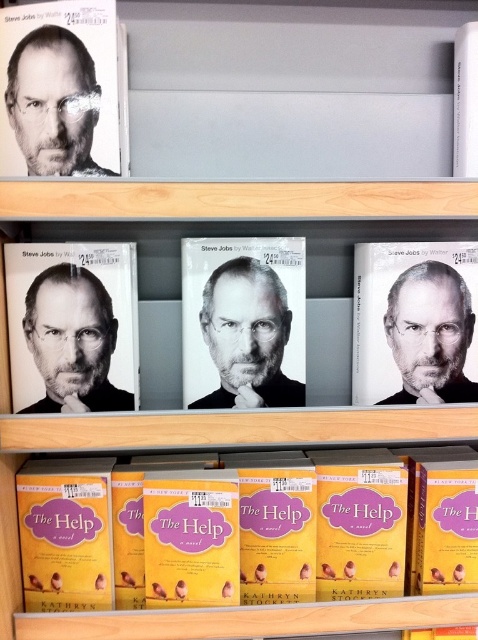
You are organizing books in a bookstore and need to place a new yellow paperback at the same location as the existing yellow paperbacks at lower center. According to the store layout, the coordinates for the lower shelf are from point A at the bottom left corner to point B at the bottom right corner. Can you determine if the new yellow paperback will fit within the lower shelf area?

The yellow paperbacks at lower center is located at point (273, 529), which falls within the lower shelf area defined by points A and B. Therefore, the new yellow paperback will fit there.

You are a customer looking at the bookstore shelf. You see a black and white portrait at center and a black paper book at center. Which one is located higher on the shelf?

The black paper book at center is higher because the black and white portrait at center is positioned under it.

You are organizing a bookshelf and see the yellow paperbacks at lower center and the matte black book cover at center. Which book should you place to the right if you want to follow the current arrangement?

You should place the matte black book cover at center to the right of the yellow paperbacks at lower center since the yellow paperbacks at lower center is positioned on the left side of matte black book cover at center.